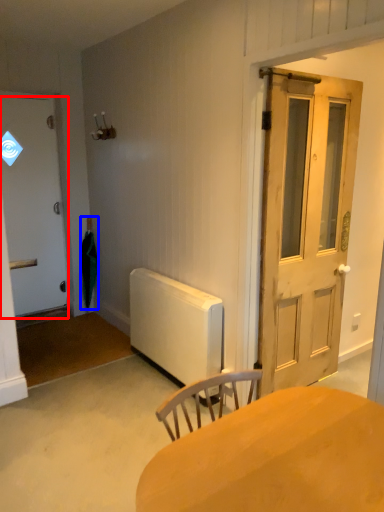
Question: Which point is closer to the camera, door (highlighted by a red box) or umbrella (highlighted by a blue box)?

Choices:
 (A) door
 (B) umbrella

Answer: (A)